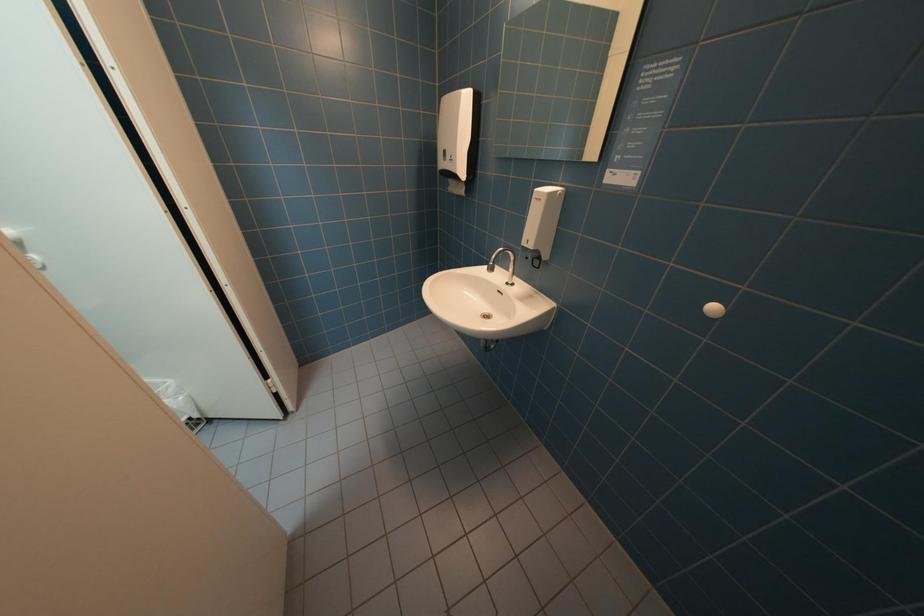
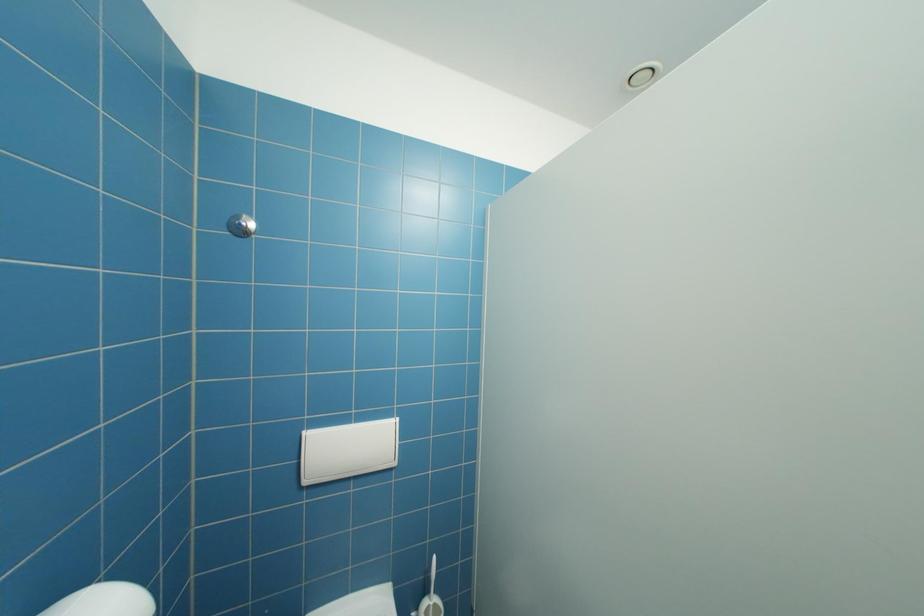
Question: The first image is from the beginning of the video and the second image is from the end. How did the camera likely rotate when shooting the video?

Choices:
 (A) Left
 (B) Right
 (C) Up
 (D) Down

Answer: (A)